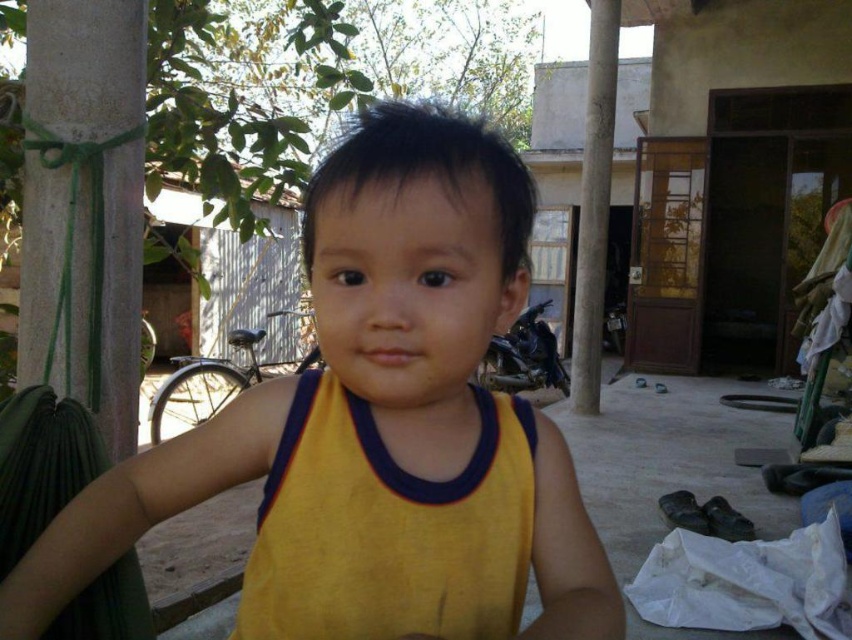
Who is higher up, yellow fabric at center or yellow fabric vest at center?

yellow fabric vest at center is higher up.

Does yellow fabric at center appear on the left side of yellow fabric vest at center?

Indeed, yellow fabric at center is positioned on the left side of yellow fabric vest at center.

Between point (452, 150) and point (519, 486), which one is positioned behind?

Point (519, 486)

The height and width of the screenshot is (640, 852). I want to click on yellow fabric at center, so click(x=376, y=426).